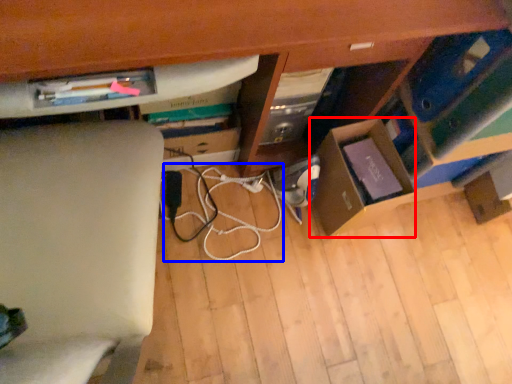
Question: Which object is further to the camera taking this photo, cardboard box (highlighted by a red box) or string (highlighted by a blue box)?

Choices:
 (A) cardboard box
 (B) string

Answer: (B)